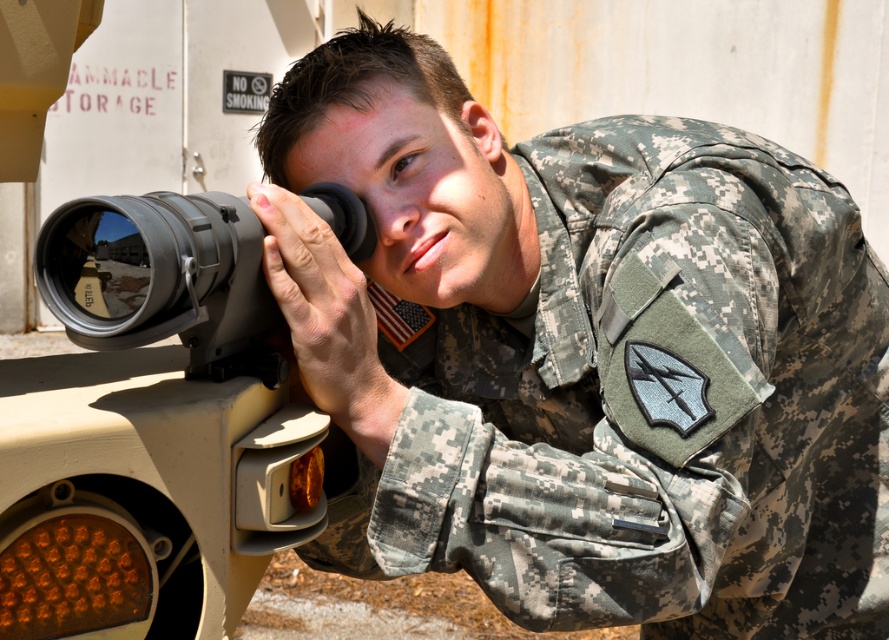
Is camouflage uniform at center below matte black scope at center?

Yes, camouflage uniform at center is below matte black scope at center.

Who is lower down, camouflage uniform at center or matte black scope at center?

Positioned lower is camouflage uniform at center.

Is point (478, 360) less distant than point (151, 268)?

No.

Where is `camouflage uniform at center`? camouflage uniform at center is located at coordinates (583, 355).